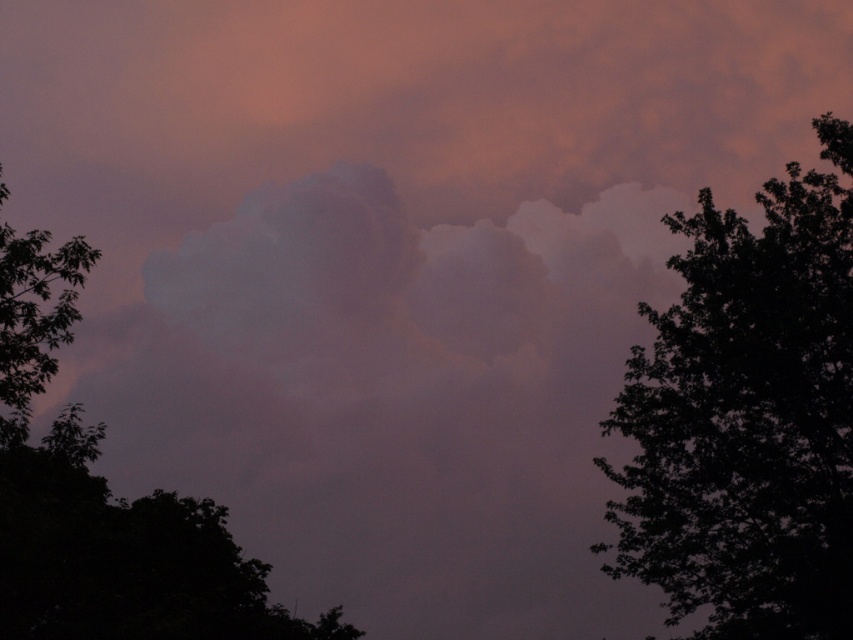
Is silhouette leafy tree at right taller than dark green leafy tree at left?

Correct, silhouette leafy tree at right is much taller as dark green leafy tree at left.

Does point (691, 461) come closer to viewer compared to point (45, 582)?

No, it is not.

Locate an element on the screen. The width and height of the screenshot is (853, 640). silhouette leafy tree at right is located at coordinates (746, 420).

Does dark green leafy tree at left have a smaller size compared to green leafy tree at left?

No.

Between point (141, 566) and point (1, 392), which one is positioned in front?

Positioned in front is point (1, 392).

The width and height of the screenshot is (853, 640). I want to click on dark green leafy tree at left, so click(x=103, y=502).

In the scene shown: Does silhouette leafy tree at right have a lesser width compared to green leafy tree at left?

Yes, silhouette leafy tree at right is thinner than green leafy tree at left.

What do you see at coordinates (746, 420) in the screenshot?
I see `silhouette leafy tree at right` at bounding box center [746, 420].

Which is in front, point (769, 259) or point (50, 362)?

Point (50, 362)

At what (x,y) coordinates should I click in order to perform the action: click on silhouette leafy tree at right. Please return your answer as a coordinate pair (x, y). The width and height of the screenshot is (853, 640). Looking at the image, I should click on (746, 420).